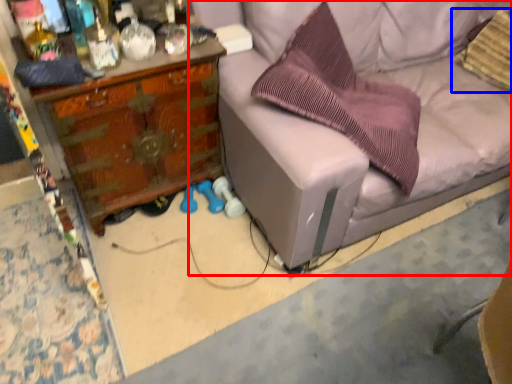
Question: Which of the following is the farthest to the observer, studio couch (highlighted by a red box) or pillow (highlighted by a blue box)?

Choices:
 (A) studio couch
 (B) pillow

Answer: (B)